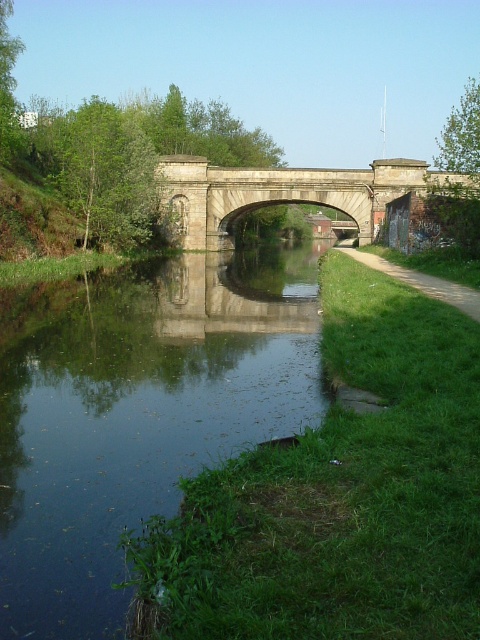
Question: Which point is closer to the camera taking this photo?

Choices:
 (A) (344, 182)
 (B) (40, 522)
 (C) (380, 260)

Answer: (B)

Question: Which point is farther to the camera?

Choices:
 (A) green reflective water at center
 (B) stone bridge at center
 (C) green grassy path at right

Answer: (B)

Question: Among these points, which one is farthest from the camera?

Choices:
 (A) (477, 305)
 (B) (336, 180)

Answer: (B)

Question: Is green reflective water at center bigger than stone bridge at center?

Choices:
 (A) no
 (B) yes

Answer: (A)

Question: Does green reflective water at center appear on the left side of stone bridge at center?

Choices:
 (A) yes
 (B) no

Answer: (A)

Question: Can you confirm if stone bridge at center is bigger than green grassy path at right?

Choices:
 (A) no
 (B) yes

Answer: (B)